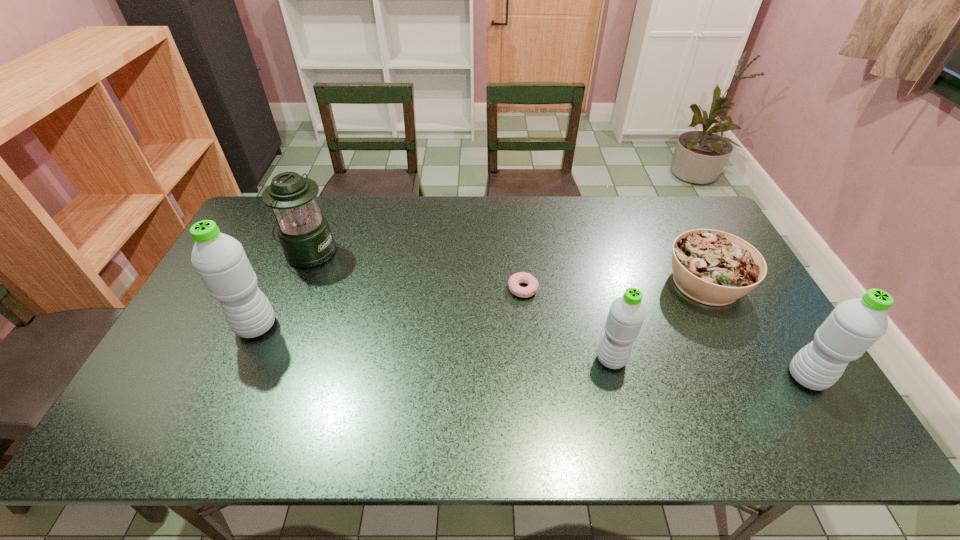
Please determine a free point for an extra water_bottle to ensure balance. Please provide its 2D coordinates. Your answer should be formatted as a tuple, i.e. [(x, y)], where the tuple contains the x and y coordinates of a point satisfying the conditions above.

[(428, 342)]